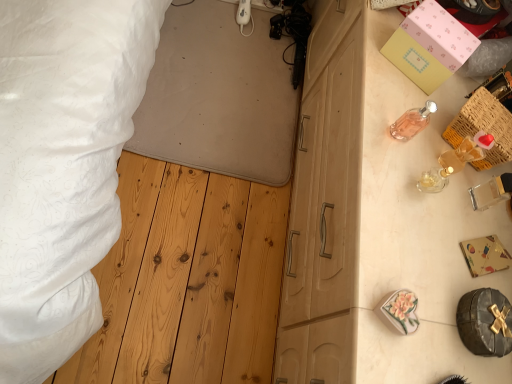
Identify the location of free area in between gold foil gift box at right, marked as the first box in a bottom-to-top arrangement, and pink glass perfume at upper right. This screenshot has height=384, width=512. (437, 188).